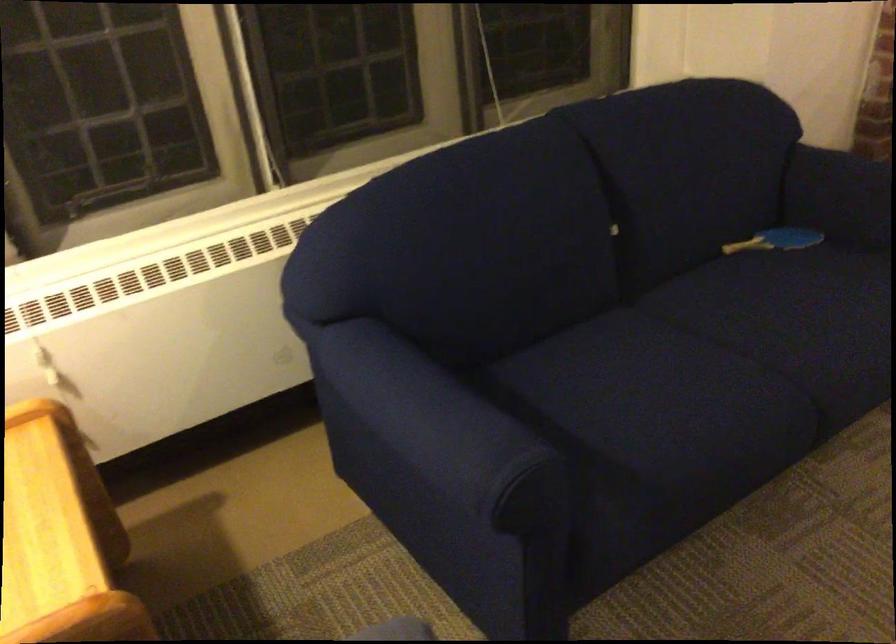
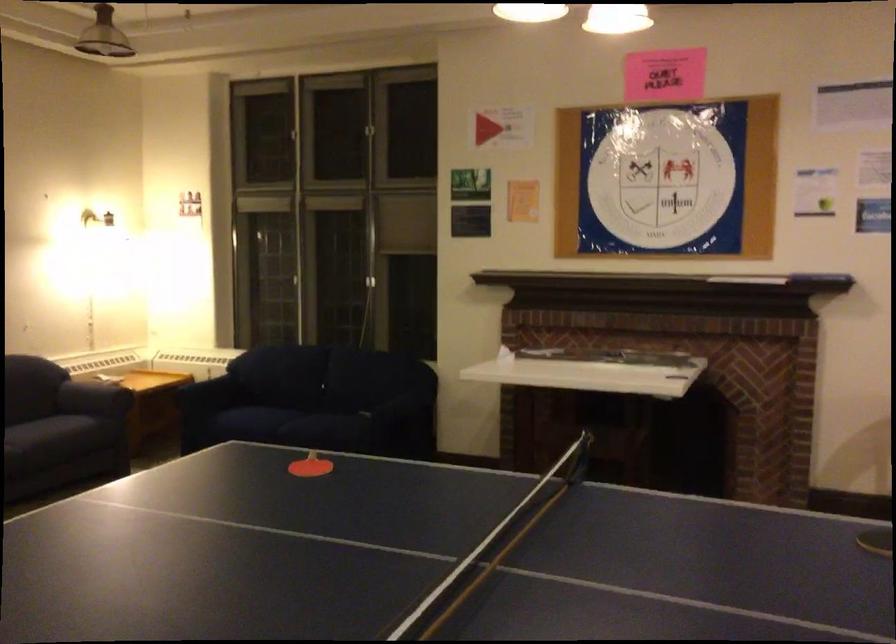
The point at (x=448, y=504) is marked in the first image. Where is the corresponding point in the second image?

(185, 398)